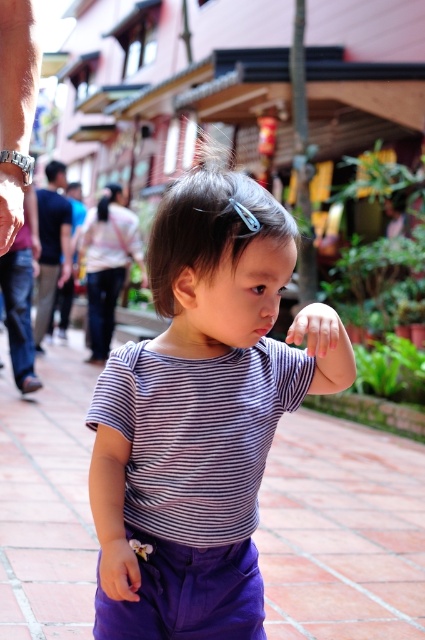
You are standing in the street scene and want to walk towards the closest point between point (257, 481) and point (62, 209). Which point should you head towards?

Point (257, 481) is closer to the viewer than point (62, 209), so you should head towards point (257, 481).

You are a photographer trying to capture the child in the scene. You notice the purple fabric pants at center and the black cotton shirt at left. Which object should you focus on first if you want to capture the child from left to right?

The black cotton shirt at left should be focused on first since it is positioned to the left of the purple fabric pants at center, aligning with the left to right direction.

You are a photographer trying to capture a photo of the striped fabric toddler at center and the black cotton shirt at left. Given that the toddler is wider than the shirt, how should you frame the shot to ensure both subjects are fully visible?

The striped fabric toddler at center is wider than the black cotton shirt at left, so you should frame the shot with a wider angle to accommodate the toddler, ensuring both subjects are fully visible.